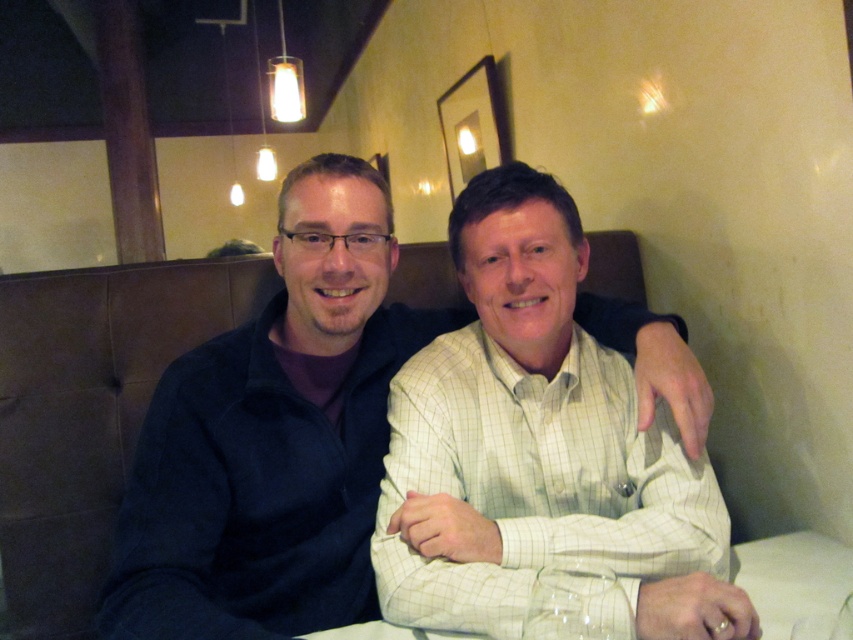
You are a server in a restaurant. You need to place a new wine glass that is 3 inches in diameter on the table. The light green checkered shirt at center is currently 10.68 inches away from the clear glass wine glass at lower center. Is there enough space between them to place the new wine glass without it touching either?

The distance between the light green checkered shirt at center and the clear glass wine glass at lower center is 10.68 inches. Since the new wine glass is 3 inches in diameter, the space required between them would be at least 1.5 inches on each side. The total needed space would be 3 inches plus 1.5 inches on both sides, totaling 6 inches. Since 10.68 inches is greater than 6 inches, there is sufficient space to place the new wine glass without it touching either object.

You are a waiter at the restaurant and need to place a new wine glass on the table. Given the sizes of the clear glass table at center and the clear glass wine glass at lower center, will there be enough space for the new wine glass on the table?

The clear glass table at center is bigger than the clear glass wine glass at lower center, so there should be enough space to place the new wine glass on the table.